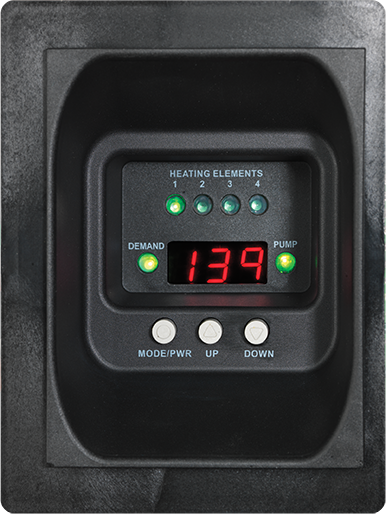
Find the location of `heating`. heating is located at coordinates (200, 176).